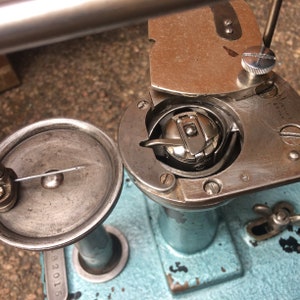
Image resolution: width=300 pixels, height=300 pixels. Identify the location of screws. (167, 178), (213, 186), (143, 104), (229, 22), (230, 28).